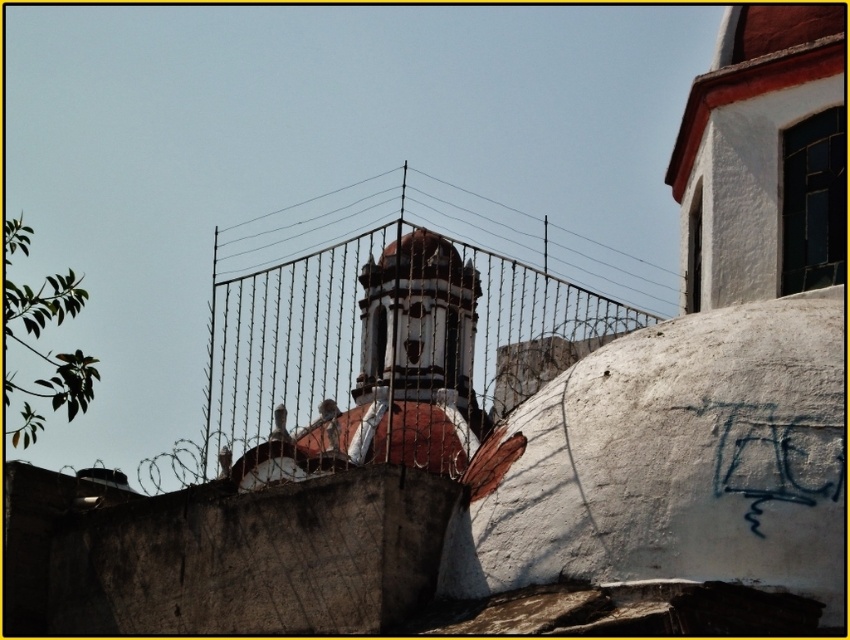
Question: Considering the relative positions of metallic wire fence at center and blue graffiti at center-right in the image provided, where is metallic wire fence at center located with respect to blue graffiti at center-right?

Choices:
 (A) left
 (B) right

Answer: (A)

Question: Which point is closer to the camera?

Choices:
 (A) blue graffiti at center-right
 (B) metallic wire fence at center

Answer: (A)

Question: Which point is farther to the camera?

Choices:
 (A) metallic wire fence at center
 (B) blue graffiti at center-right

Answer: (A)

Question: Observing the image, what is the correct spatial positioning of metallic wire fence at center in reference to blue graffiti at center-right?

Choices:
 (A) below
 (B) above

Answer: (B)

Question: Which point is closer to the camera?

Choices:
 (A) metallic wire fence at center
 (B) blue graffiti at center-right

Answer: (B)

Question: Can you confirm if metallic wire fence at center is positioned to the left of blue graffiti at center-right?

Choices:
 (A) yes
 (B) no

Answer: (A)